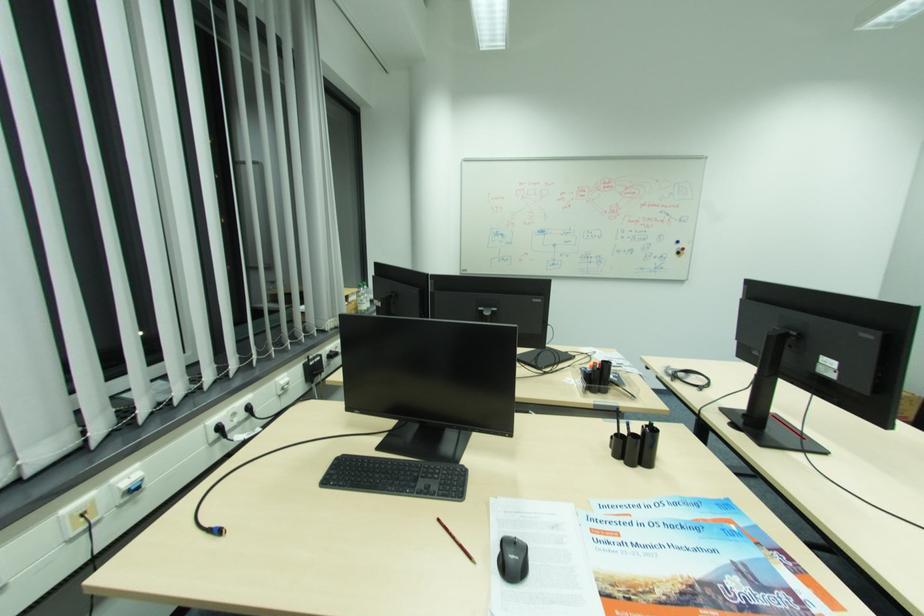
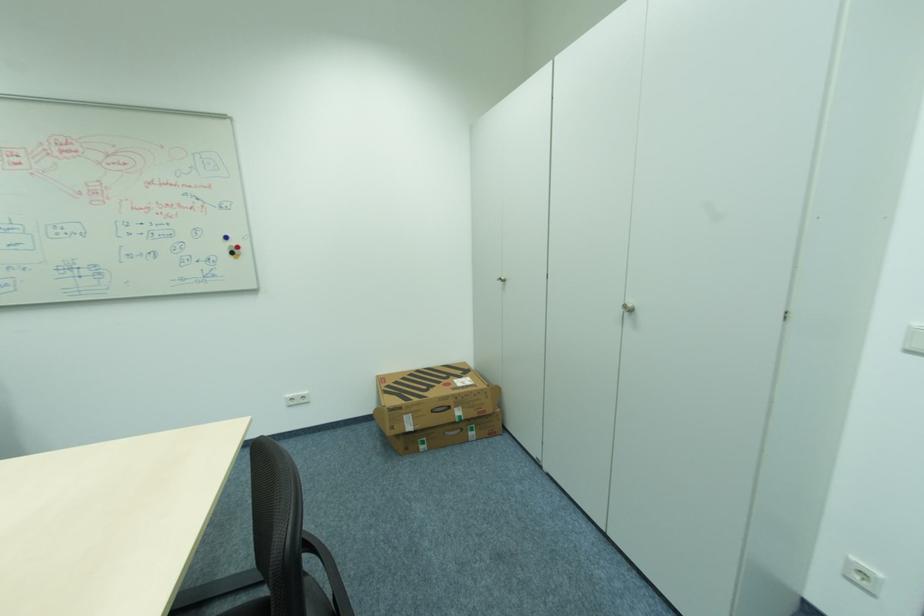
Question: Which direction would the cameraman need to move to produce the second image? Reply with the corresponding letter.

Choices:
 (A) Left
 (B) Right
 (C) Forward
 (D) Backward

Answer: (B)